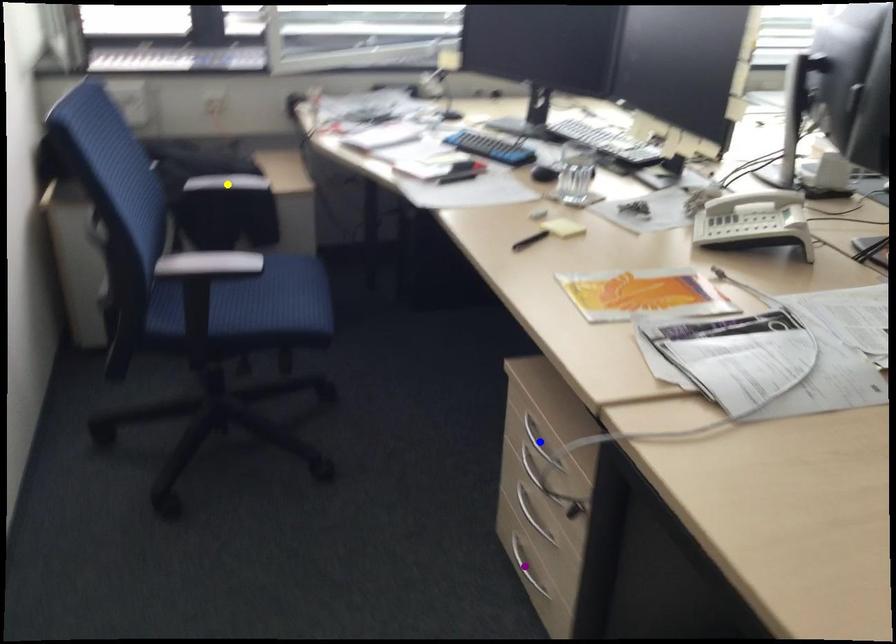
Order these from nearest to farthest:
blue point, purple point, yellow point

blue point, purple point, yellow point